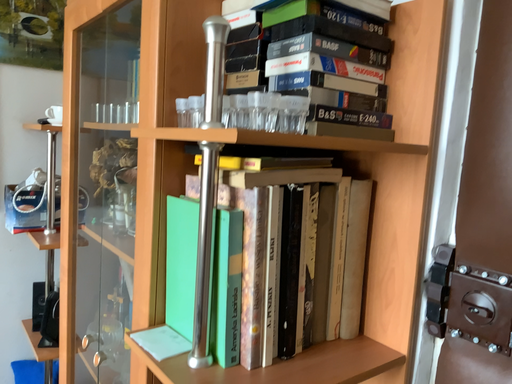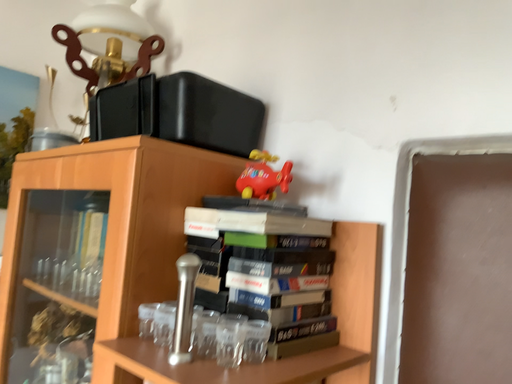
Question: How did the camera likely rotate when shooting the video?

Choices:
 (A) rotated left
 (B) rotated right

Answer: (B)